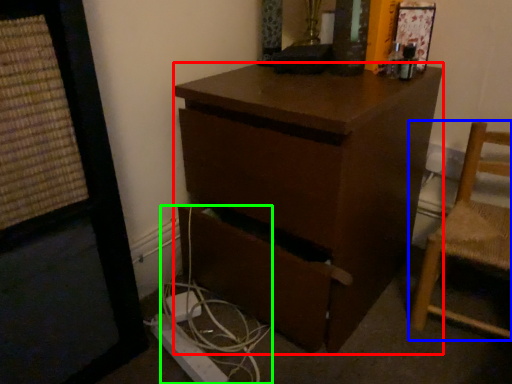
Question: Estimate the real-world distances between objects in this image. Which object is farther from desk (highlighted by a red box), chair (highlighted by a blue box) or cable (highlighted by a green box)?

Choices:
 (A) chair
 (B) cable

Answer: (A)